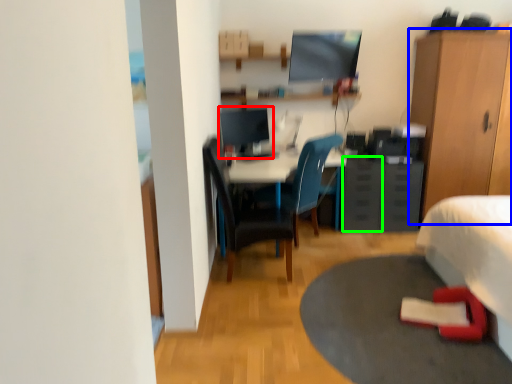
Question: Which object is positioned closest to computer monitor (highlighted by a red box)? Select from cabinetry (highlighted by a blue box) and drawer (highlighted by a green box).

Choices:
 (A) cabinetry
 (B) drawer

Answer: (B)